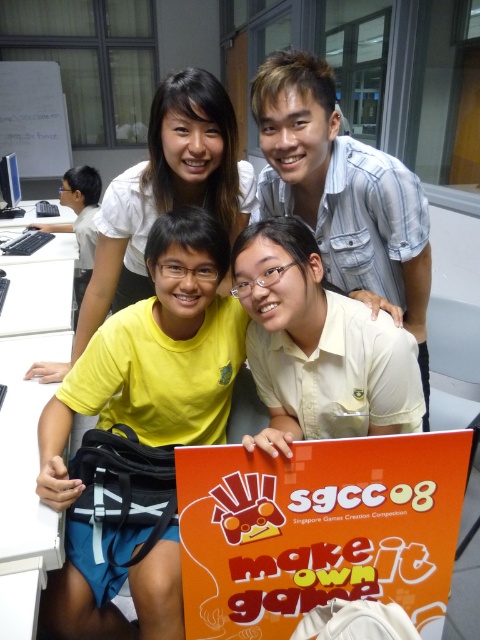
Question: Among these objects, which one is nearest to the camera?

Choices:
 (A) white matte shirt at center
 (B) white plastic table at lower left
 (C) yellow fabric shirt at lower left

Answer: (B)

Question: Estimate the real-world distances between objects in this image. Which object is farther from the white plastic table at left?

Choices:
 (A) white plastic table at lower left
 (B) white matte shirt at center

Answer: (B)

Question: Does white plastic table at lower left have a greater width compared to white plastic table at left?

Choices:
 (A) yes
 (B) no

Answer: (B)

Question: Is white matte shirt at center to the right of white plastic table at lower left from the viewer's perspective?

Choices:
 (A) no
 (B) yes

Answer: (B)

Question: Which point appears farthest from the camera in this image?

Choices:
 (A) (81, 593)
 (B) (336, 310)
 (C) (3, 579)

Answer: (B)

Question: Does yellow fabric shirt at lower left have a larger size compared to white plastic table at lower left?

Choices:
 (A) yes
 (B) no

Answer: (B)